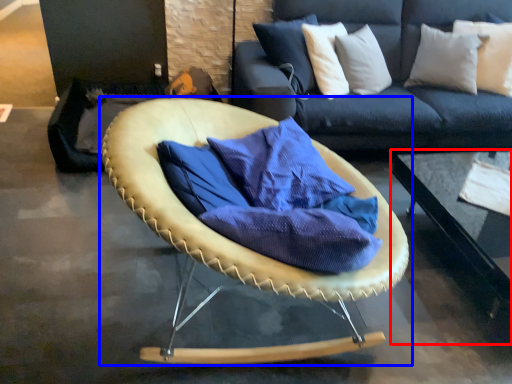
Question: Which object appears closest to the camera in this image, table (highlighted by a red box) or chair (highlighted by a blue box)?

Choices:
 (A) table
 (B) chair

Answer: (B)